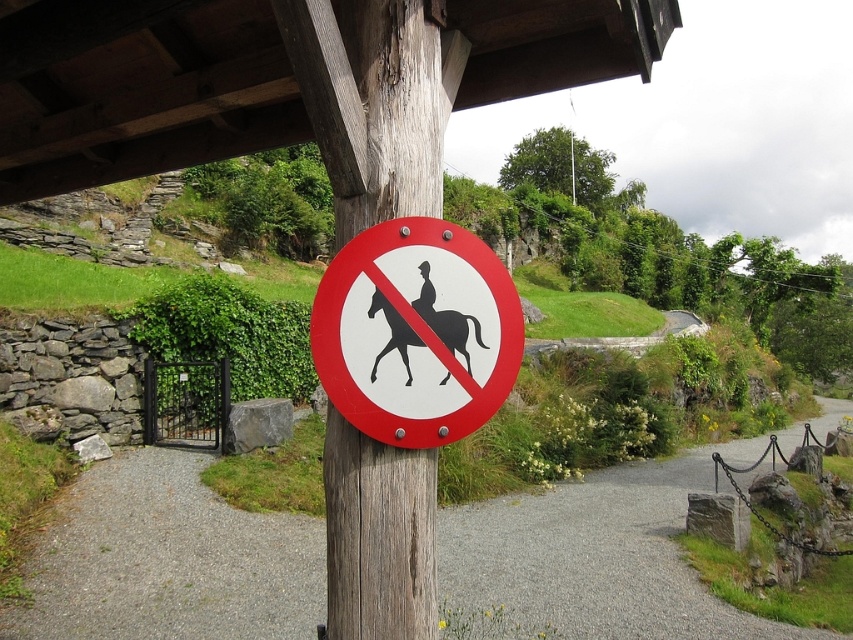
You are a hiker who wants to take a photo of the black matte horse at center and the white paper sign at center. Which object should you focus on first if you want both to be in clear focus?

The black matte horse at center is behind the white paper sign at center, so you should focus on the white paper sign at center first to ensure both are in clear focus.

You are a delivery person with a 2.5 meter long cart. You need to navigate through the gravel path at center and around the wooden post at center. Can your cart fit through the space between them?

The gravel path at center is 5.10 meters from the wooden post at center. Since your cart is 2.5 meters long, it can easily fit through the space as the distance between them is more than double the cart length.